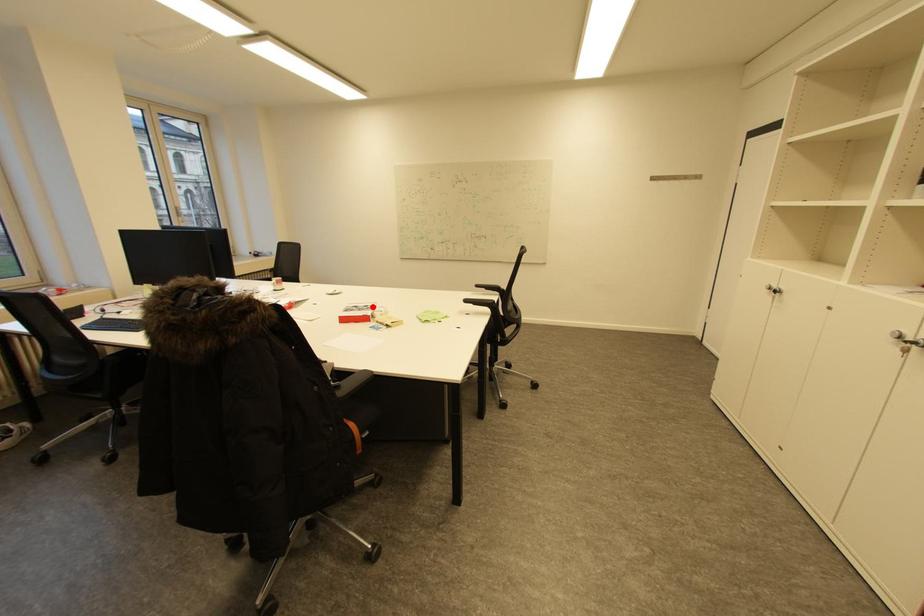
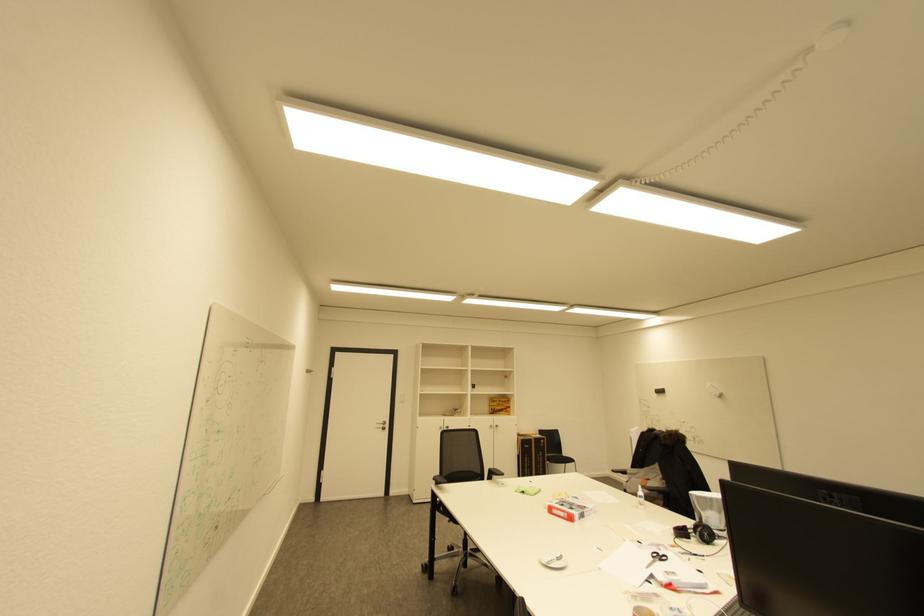
Question: I am providing you with two images of the same scene from different viewpoints. In image1, a red point is highlighted. Considering the same 3D point in image2, which of the following is correct?

Choices:
 (A) It is closer
 (B) It is farther

Answer: (A)